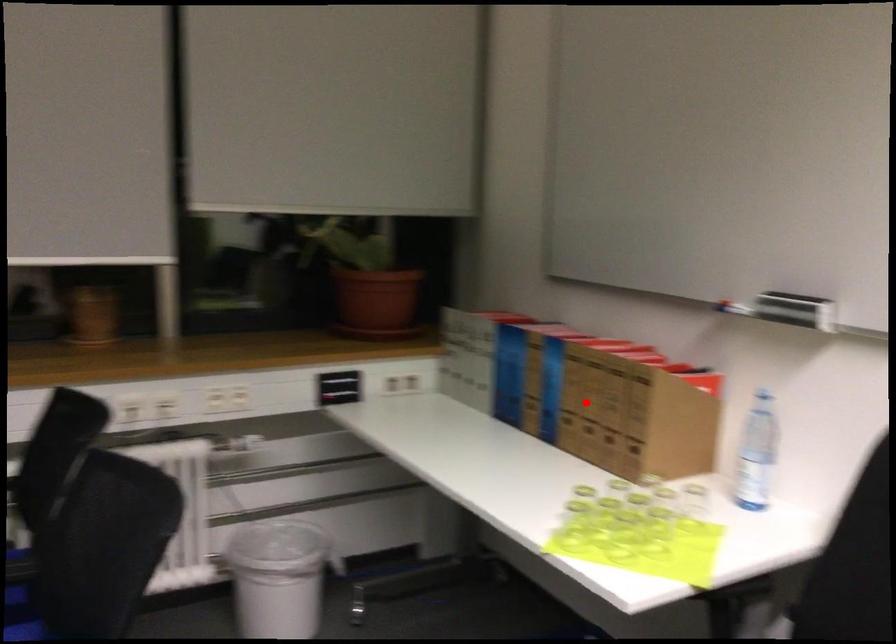
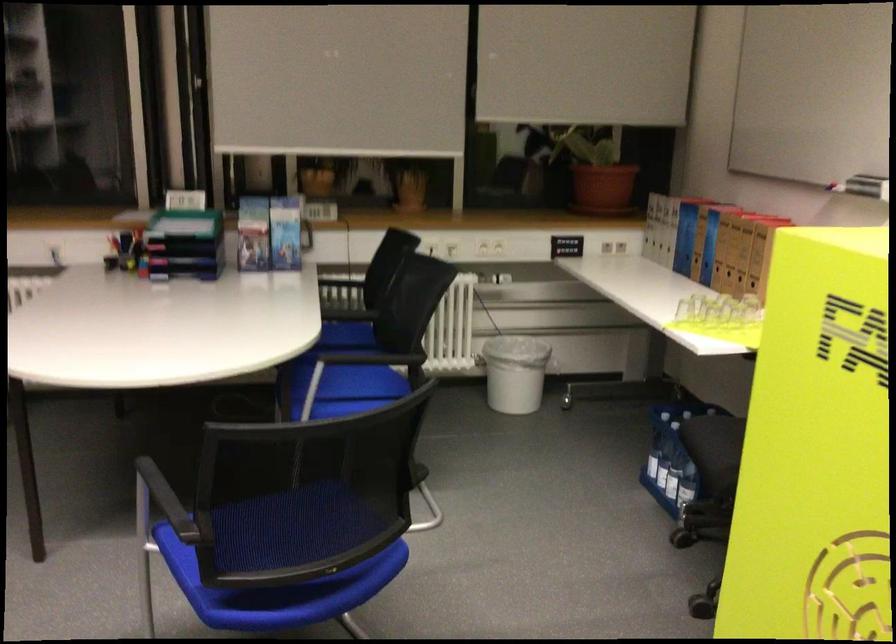
Locate, in the second image, the point that corresponds to the highlighted location in the first image.

(730, 251)